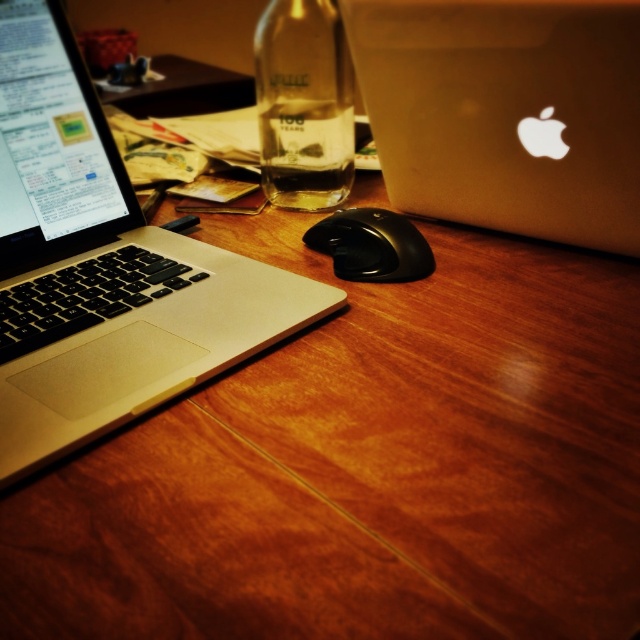
Question: Is silver metallic laptop at upper right smaller than black matte mouse at center?

Choices:
 (A) yes
 (B) no

Answer: (B)

Question: Is silver metallic laptop at upper right smaller than clear glass bottle at center?

Choices:
 (A) yes
 (B) no

Answer: (B)

Question: Among these objects, which one is nearest to the camera?

Choices:
 (A) clear glass bottle at center
 (B) silver metallic laptop at left

Answer: (B)

Question: Which point is closer to the camera taking this photo?

Choices:
 (A) (36, 410)
 (B) (544, 54)
 (C) (298, 13)

Answer: (A)

Question: Which object is farther from the camera taking this photo?

Choices:
 (A) silver metallic laptop at left
 (B) clear glass bottle at center

Answer: (B)

Question: Does clear glass bottle at center have a larger size compared to black matte mouse at center?

Choices:
 (A) yes
 (B) no

Answer: (A)